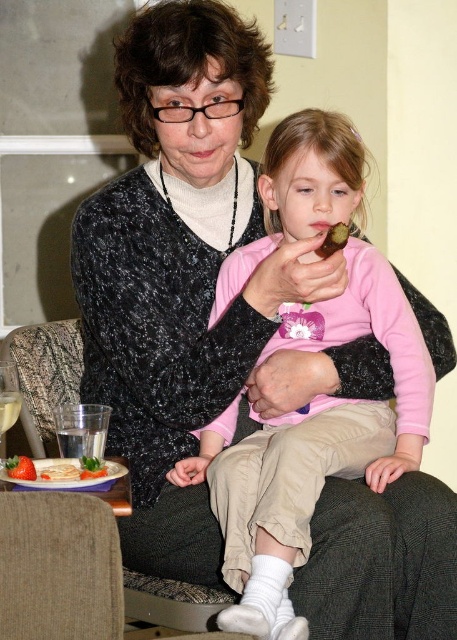
You are a nutritionist visiting the family and see the smooth red strawberry at lower left and the green leafy vegetable at lower left on the table. Which food item is bigger in size?

The smooth red strawberry at lower left is larger in size than the green leafy vegetable at lower left.